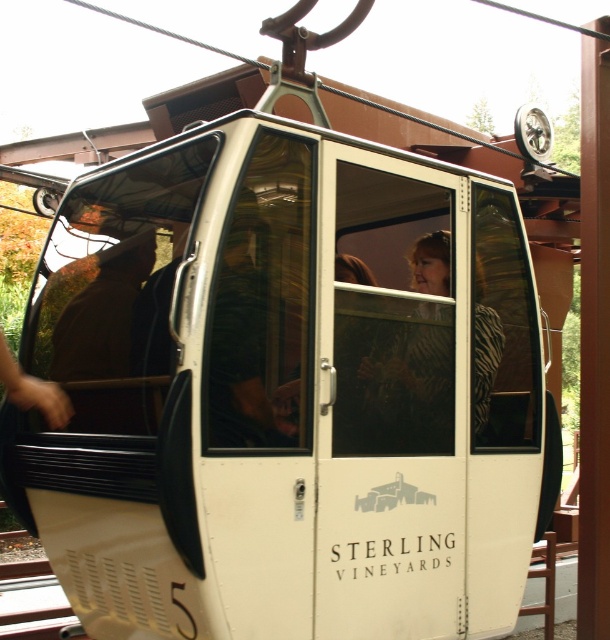
Question: Can you confirm if transparent glass window at center is positioned below zebra print blouse at center?

Choices:
 (A) no
 (B) yes

Answer: (A)

Question: Which object is positioned closest to the transparent glass window at center?

Choices:
 (A) brown woolen hat at center
 (B) transparent glass door at center

Answer: (B)

Question: Is transparent glass window at center thinner than zebra print blouse at center?

Choices:
 (A) yes
 (B) no

Answer: (A)

Question: Which point is closer to the camera?

Choices:
 (A) (427, 307)
 (B) (437, 326)

Answer: (A)

Question: Which object appears farthest from the camera in this image?

Choices:
 (A) transparent glass window at center
 (B) transparent glass door at center
 (C) brown woolen hat at center

Answer: (A)

Question: Does transparent glass window at center appear on the right side of brown woolen hat at center?

Choices:
 (A) no
 (B) yes

Answer: (B)